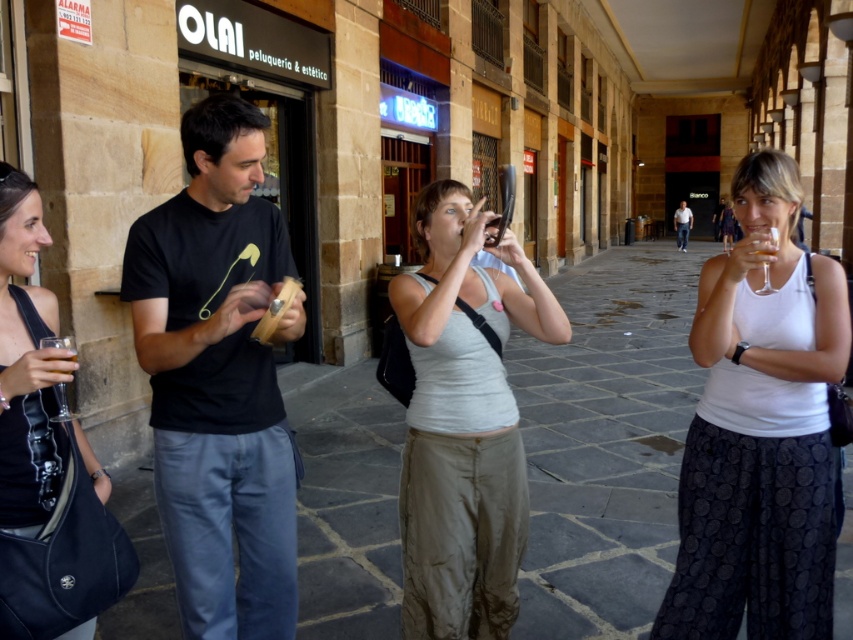
Between black leather bag at lower left and clear glass at lower left, which one is positioned higher?

clear glass at lower left is above.

Is black leather bag at lower left taller than clear glass at lower left?

Yes, black leather bag at lower left is taller than clear glass at lower left.

What do you see at coordinates (24, 372) in the screenshot? The height and width of the screenshot is (640, 853). I see `black leather bag at lower left` at bounding box center [24, 372].

What are the coordinates of `black leather bag at lower left` in the screenshot? It's located at (24, 372).

Does black matte t-shirt at center appear over black leather bag at lower left?

Correct, black matte t-shirt at center is located above black leather bag at lower left.

Identify the location of black matte t-shirt at center. The width and height of the screenshot is (853, 640). (218, 380).

This screenshot has width=853, height=640. I want to click on white cotton tank top at center, so click(759, 429).

What do you see at coordinates (759, 429) in the screenshot?
I see `white cotton tank top at center` at bounding box center [759, 429].

Where is `white cotton tank top at center`? white cotton tank top at center is located at coordinates (759, 429).